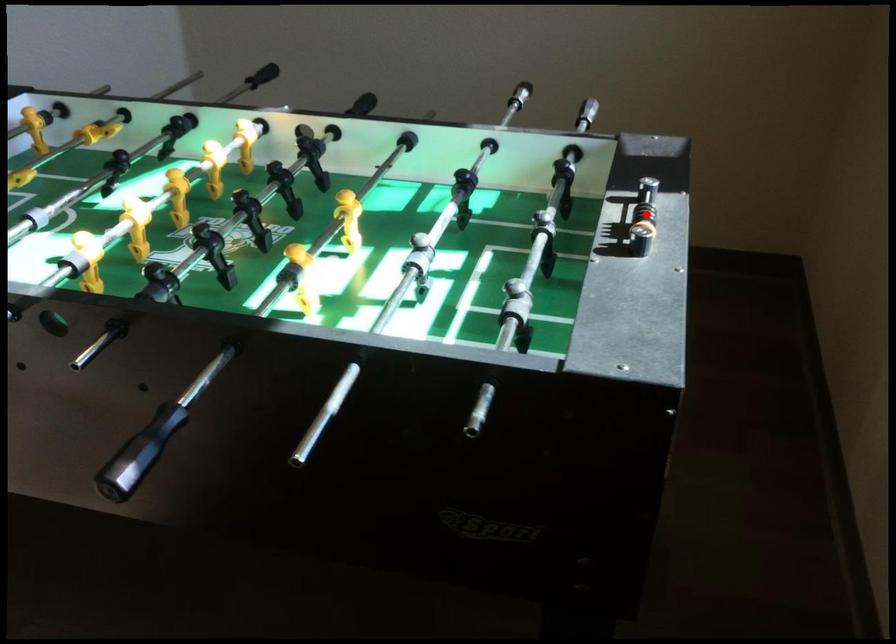
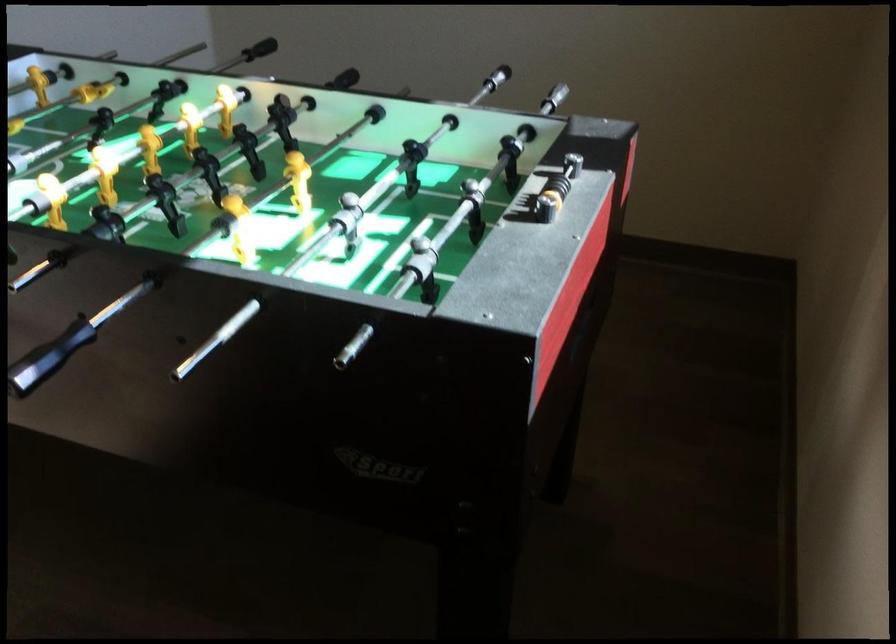
Where in the second image is the point corresponding to the highlighted location from the first image?

(556, 185)